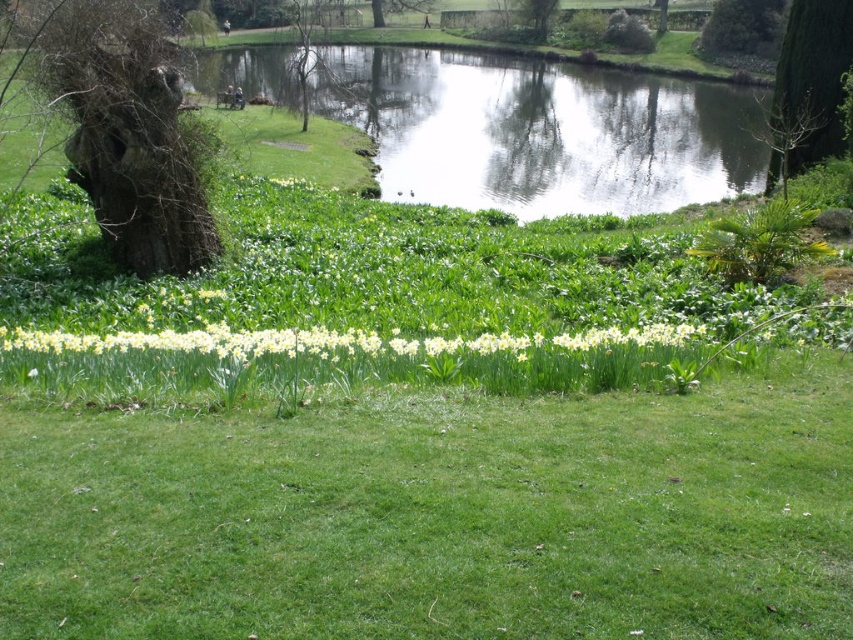
Is brown textured tree at left below green leafy tree at upper right?

Indeed, brown textured tree at left is positioned under green leafy tree at upper right.

Looking at this image, who is lower down, brown textured tree at left or green leafy tree at upper right?

Positioned lower is brown textured tree at left.

Describe the element at coordinates (123, 128) in the screenshot. I see `brown textured tree at left` at that location.

Where is `brown textured tree at left`? The width and height of the screenshot is (853, 640). brown textured tree at left is located at coordinates (123, 128).

Based on the photo, which is below, clear water at upper center or green leafy tree at upper center?

clear water at upper center is lower down.

This screenshot has height=640, width=853. What do you see at coordinates (540, 131) in the screenshot?
I see `clear water at upper center` at bounding box center [540, 131].

Is point (618, 116) in front of point (535, 1)?

Yes, point (618, 116) is in front of point (535, 1).

This screenshot has height=640, width=853. Identify the location of clear water at upper center. (540, 131).

Does clear water at upper center come in front of green textured tree at upper right?

No, it is behind green textured tree at upper right.

Does clear water at upper center have a greater width compared to green textured tree at upper right?

Correct, the width of clear water at upper center exceeds that of green textured tree at upper right.

Where is `clear water at upper center`? The width and height of the screenshot is (853, 640). clear water at upper center is located at coordinates (540, 131).